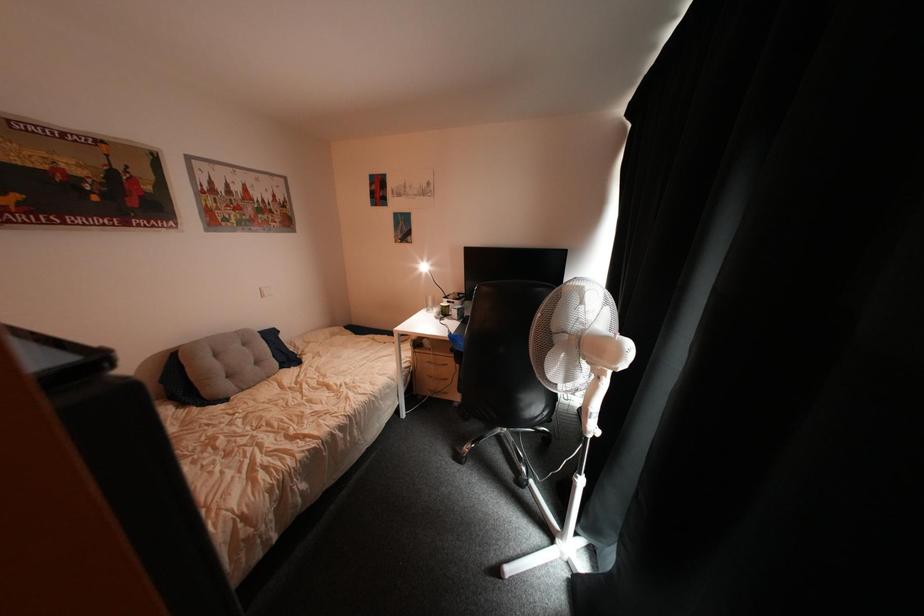
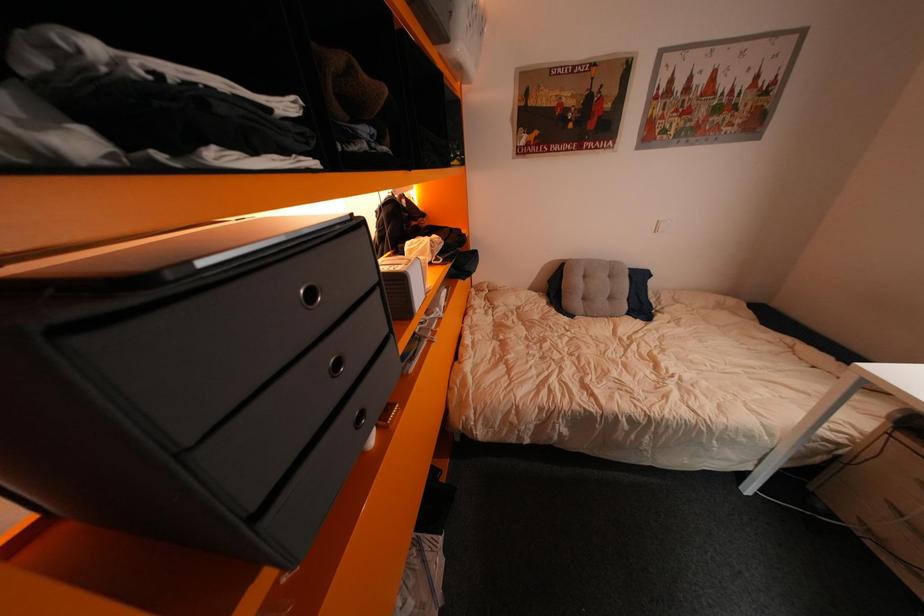
The first image is from the beginning of the video and the second image is from the end. How did the camera likely rotate when shooting the video?

The rotation direction of the camera is left-down.